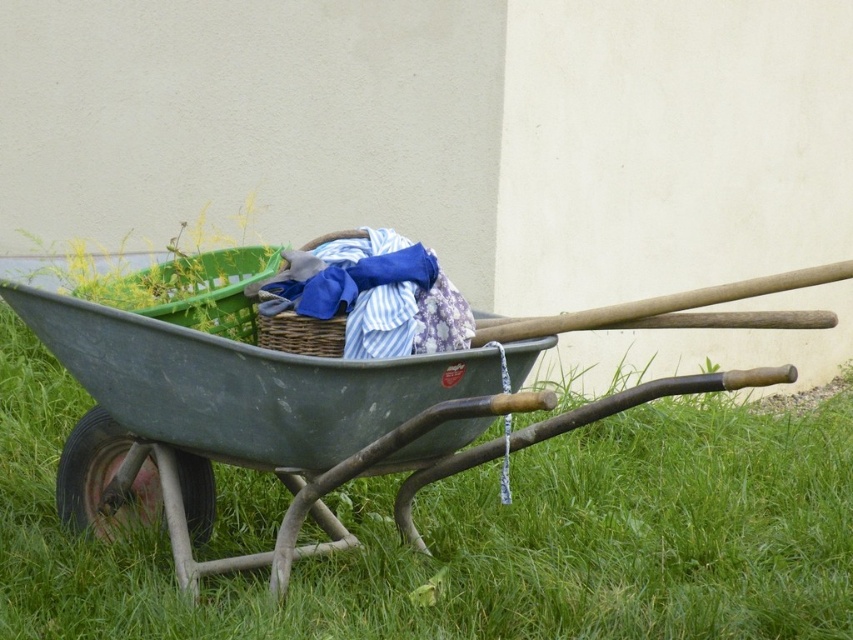
Question: Considering the relative positions of blue striped fabric at center and woven brown basket at center in the image provided, where is blue striped fabric at center located with respect to woven brown basket at center?

Choices:
 (A) left
 (B) right

Answer: (B)

Question: Which object is the closest to the woven brown basket at center?

Choices:
 (A) green metal wheelbarrow at center
 (B) blue striped fabric at center

Answer: (B)

Question: Can you confirm if green metal wheelbarrow at center is positioned to the left of woven brown basket at center?

Choices:
 (A) yes
 (B) no

Answer: (B)

Question: Is blue striped fabric at center to the right of woven brown basket at center from the viewer's perspective?

Choices:
 (A) no
 (B) yes

Answer: (B)

Question: Which point is farther to the camera?

Choices:
 (A) (300, 276)
 (B) (93, 352)

Answer: (B)

Question: Which of these objects is positioned farthest from the woven brown basket at center?

Choices:
 (A) green metal wheelbarrow at center
 (B) blue striped fabric at center

Answer: (A)